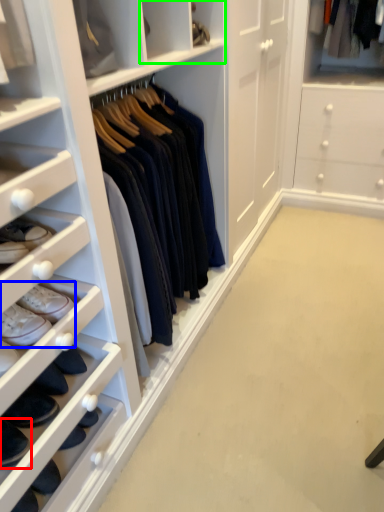
Question: Estimate the real-world distances between objects in this image. Which object is closer to footwear (highlighted by a red box), footwear (highlighted by a blue box) or cabinet (highlighted by a green box)?

Choices:
 (A) footwear
 (B) cabinet

Answer: (A)